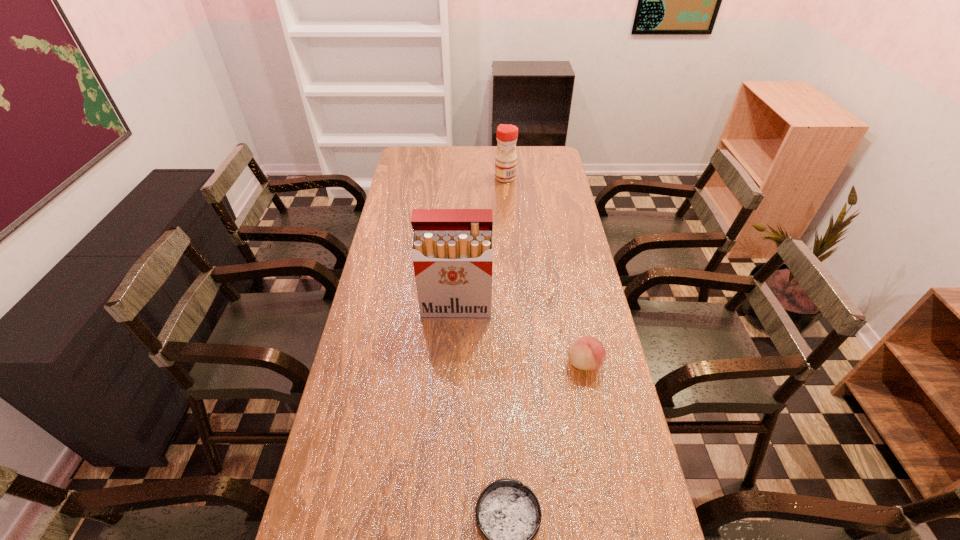
Locate an element on the screen. The width and height of the screenshot is (960, 540). object located in the right edge section of the desktop is located at coordinates (587, 353).

Where is `vacant space at the far edge of the desktop`? This screenshot has width=960, height=540. vacant space at the far edge of the desktop is located at coordinates (452, 152).

Where is `vacant space at the left edge`? vacant space at the left edge is located at coordinates (378, 463).

Image resolution: width=960 pixels, height=540 pixels. I want to click on vacant space at the right edge, so click(x=563, y=180).

Where is `free space at the far right corner of the desktop`? Image resolution: width=960 pixels, height=540 pixels. free space at the far right corner of the desktop is located at coordinates (542, 160).

At what (x,y) coordinates should I click in order to perform the action: click on unoccupied position between the rightmost object and the third nearest object. Please return your answer as a coordinate pair (x, y). Looking at the image, I should click on (520, 336).

This screenshot has height=540, width=960. I want to click on unoccupied area between the farthest object and the second shortest object, so click(544, 271).

Image resolution: width=960 pixels, height=540 pixels. In order to click on vacant region between the condiment and the second shortest object in this screenshot , I will do `click(544, 271)`.

Locate an element on the screen. This screenshot has height=540, width=960. object that stands as the second closest to the nearest object is located at coordinates (452, 248).

Select which object appears as the closest to the shortest object. Please provide its 2D coordinates. Your answer should be formatted as a tuple, i.e. [(x, y)], where the tuple contains the x and y coordinates of a point satisfying the conditions above.

[(587, 353)]